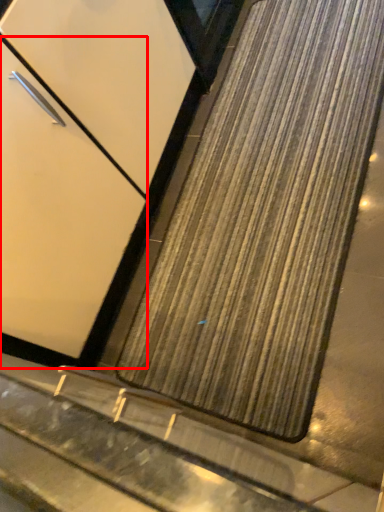
Question: From the image's perspective, considering the relative positions of door (annotated by the red box) and mat in the image provided, where is door (annotated by the red box) located with respect to the staircase?

Choices:
 (A) below
 (B) above

Answer: (B)